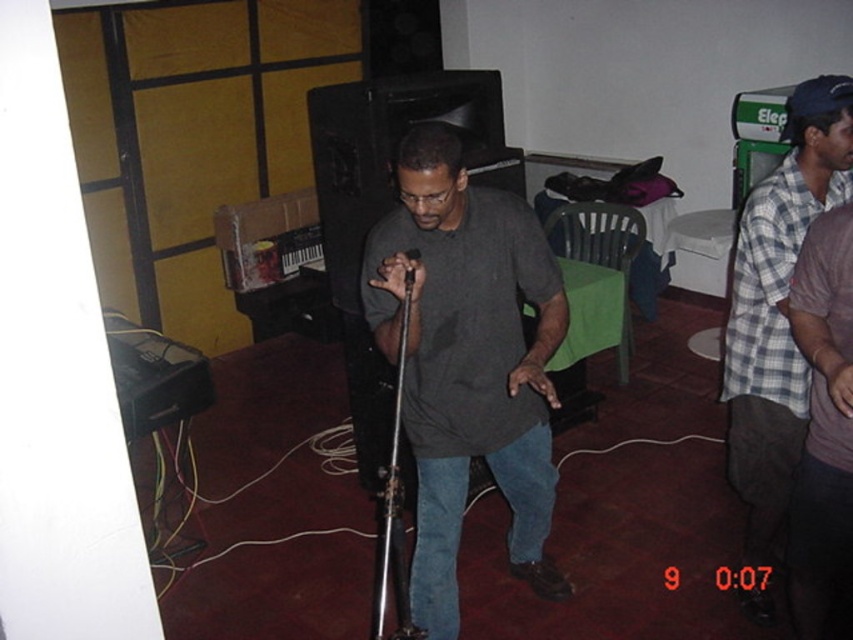
Question: Does purple cotton shirt at right have a greater width compared to metallic silver microphone at center?

Choices:
 (A) yes
 (B) no

Answer: (A)

Question: Where is dark gray matte shirt at center located in relation to purple cotton shirt at right in the image?

Choices:
 (A) below
 (B) above

Answer: (B)

Question: Can you confirm if plaid shirt at right is positioned to the right of purple cotton shirt at right?

Choices:
 (A) yes
 (B) no

Answer: (A)

Question: Among these points, which one is farthest from the camera?

Choices:
 (A) (404, 276)
 (B) (520, 369)
 (C) (790, 408)

Answer: (C)

Question: Which object is the farthest from the metallic silver microphone at center?

Choices:
 (A) dark gray matte shirt at center
 (B) purple cotton shirt at right

Answer: (B)

Question: Which of the following is the closest to the observer?

Choices:
 (A) dark gray matte shirt at center
 (B) purple cotton shirt at right
 (C) plaid shirt at right

Answer: (B)